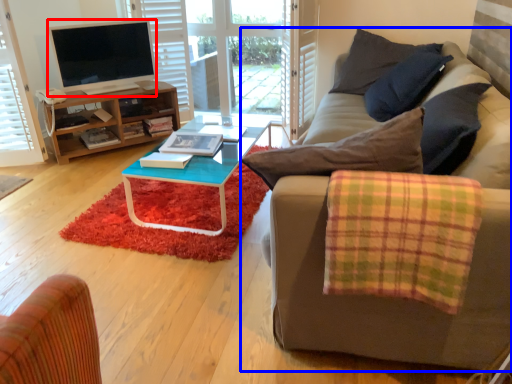
Question: Which object appears farthest to the camera in this image, television (highlighted by a red box) or studio couch (highlighted by a blue box)?

Choices:
 (A) television
 (B) studio couch

Answer: (A)